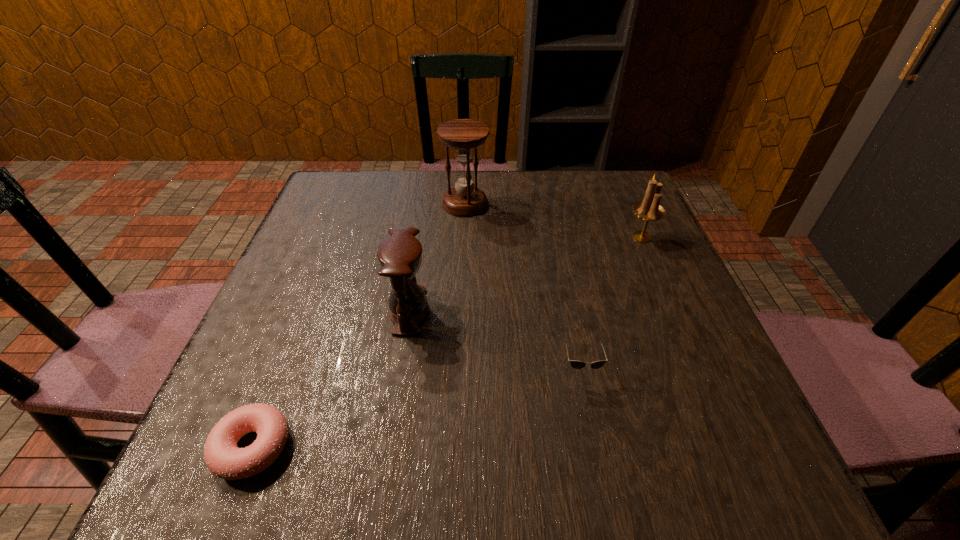
The image size is (960, 540). I want to click on free location at the far edge of the desktop, so click(509, 209).

Find the location of a particular element. vacant space at the near edge of the desktop is located at coordinates (549, 441).

In the image, there is a desktop. Where is `free region at the left edge`? The height and width of the screenshot is (540, 960). free region at the left edge is located at coordinates (280, 331).

Locate an element on the screen. This screenshot has width=960, height=540. vacant area at the right edge is located at coordinates (712, 392).

I want to click on free space at the far right corner of the desktop, so click(x=614, y=181).

In the image, there is a desktop. At what (x,y) coordinates should I click in order to perform the action: click on vacant space at the near right corner. Please return your answer as a coordinate pair (x, y). Looking at the image, I should click on (742, 466).

What are the coordinates of `free space that is in between the fourth farthest object and the right hourglass` in the screenshot? It's located at (523, 286).

This screenshot has width=960, height=540. I want to click on vacant space that's between the nearer hourglass and the rightmost object, so click(525, 274).

The image size is (960, 540). What are the coordinates of `free space between the third nearest object and the tallest object` in the screenshot? It's located at (437, 258).

Identify the location of free space between the sunglasses and the nearest object. (417, 408).